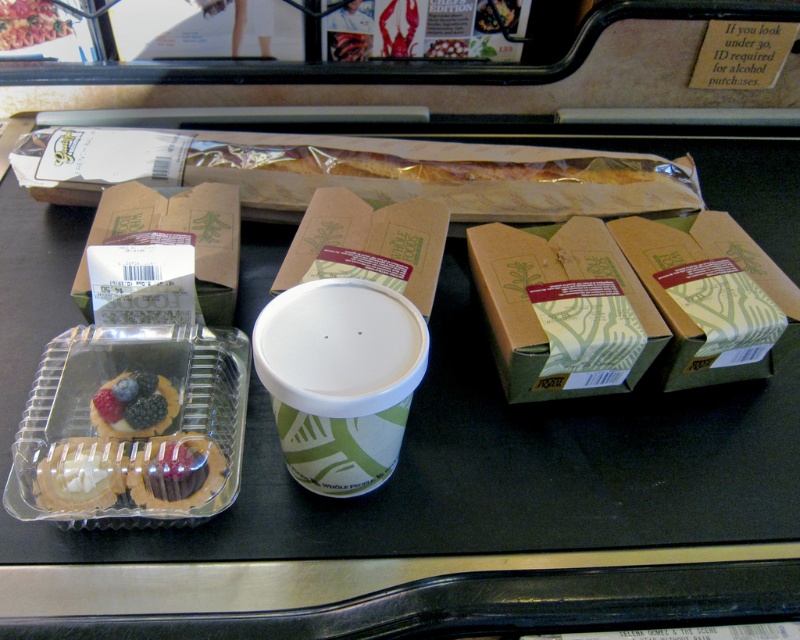
Question: Is green paper cup at center to the left of smooth plastic container at center from the viewer's perspective?

Choices:
 (A) no
 (B) yes

Answer: (A)

Question: Where is green paper cup at center located in relation to matte brown box at left in the image?

Choices:
 (A) right
 (B) left

Answer: (A)

Question: Which point is closer to the camera?

Choices:
 (A) smooth plastic container at center
 (B) brown cardboard box at right
 (C) matte plastic tartlet at center-left
 (D) green cardboard box at center

Answer: (C)

Question: Among these objects, which one is nearest to the camera?

Choices:
 (A) matte brown box at left
 (B) matte plastic tartlet at center-left
 (C) green cardboard box at center

Answer: (B)

Question: Estimate the real-world distances between objects in this image. Which object is farther from the green cardboard box at center?

Choices:
 (A) smooth plastic container at center
 (B) white glossy pastry at lower left
 (C) matte plastic tartlet at center-left

Answer: (A)

Question: Can you confirm if brown cardboard box at center is thinner than smooth plastic container at center?

Choices:
 (A) yes
 (B) no

Answer: (B)